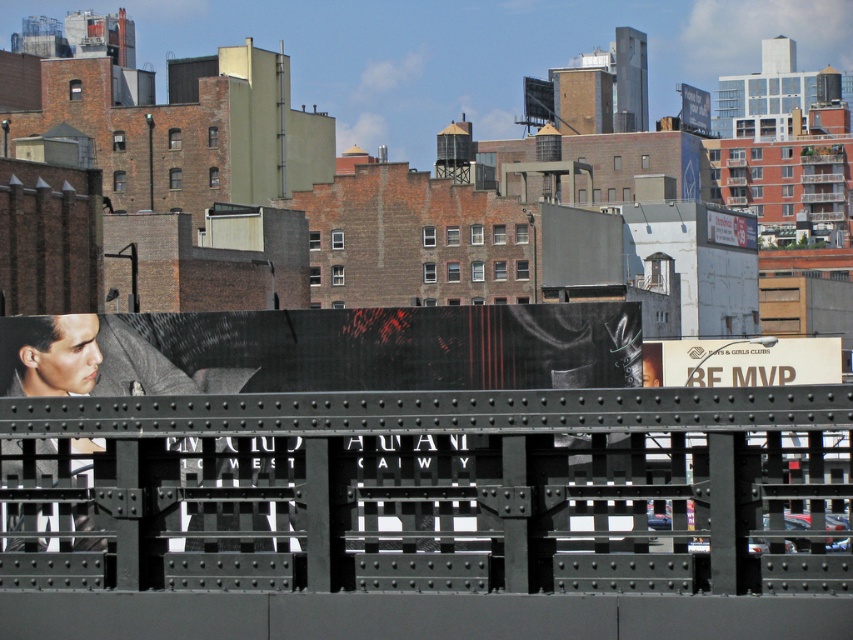
You are a pedestrian standing in front of the white cardboard sign at center and the white glossy billboard at upper center. Which object is nearer to you?

The white cardboard sign at center is closer to the viewer than the white glossy billboard at upper center.

You are a city planner reviewing the urban landscape. You need to determine which object, the white cardboard sign at center or the white glossy billboard at upper center, has a greater visual impact based on size. Which one would you choose?

The white cardboard sign at center is larger in size than the white glossy billboard at upper center, so it has a greater visual impact.